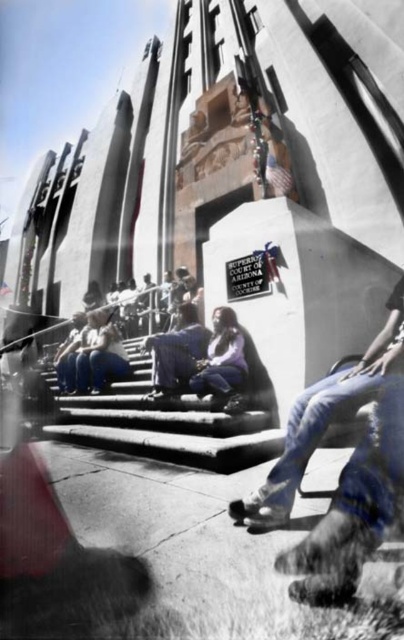
You are standing at the entrance of the Superior Court of Arizona, County of Cochise. You need to find the smooth concrete stairs at center. According to the coordinates provided, where exactly are the smooth concrete stairs located?

The smooth concrete stairs at center are located at the coordinates point (x=172, y=420).